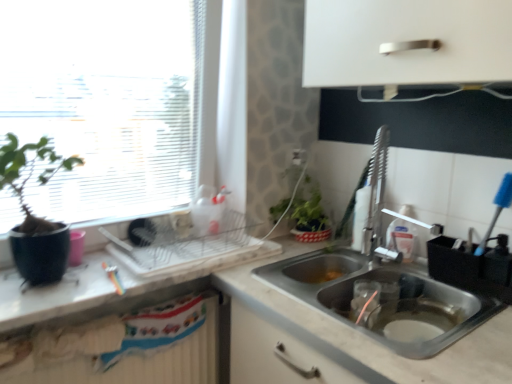
Image resolution: width=512 pixels, height=384 pixels. What do you see at coordinates (375, 341) in the screenshot?
I see `white marble countertop at lower right, which appears as the second countertop when viewed from the top` at bounding box center [375, 341].

Based on the photo, in order to face black plastic utensil holder at sink, the first appliance viewed from the right, should I rotate leftwards or rightwards?

Answer: It's best to rotate right around 27.925 degrees.

Measure the distance between point (96, 146) and camera.

The depth of point (96, 146) is 4.24 feet.

The height and width of the screenshot is (384, 512). Identify the location of white textured radiator at lower left. (113, 350).

Locate an element on the screen. The height and width of the screenshot is (384, 512). stainless steel sink at lower right, which is the first sink in top-to-bottom order is located at coordinates (340, 254).

What is the approximate height of stainless steel sink at lower right, acting as the 2th sink starting from the bottom?

It is 17.94 inches.

Describe the element at coordinates (101, 286) in the screenshot. I see `white marble countertop at left, acting as the first countertop starting from the top` at that location.

You are a GUI agent. You are given a task and a screenshot of the screen. Output one action in this format:
    pyautogui.click(x=<x>, y=<y>)
    Task: Click on the matte black pot at left
    
    Given the screenshot: What is the action you would take?
    pyautogui.click(x=31, y=212)

You are a GUI agent. You are given a task and a screenshot of the screen. Output one action in this format:
    pyautogui.click(x=<x>, y=<y>)
    Task: Click on the white marble countertop at lower right, positioned as the 1th countertop in bottom-to-top order
    
    Given the screenshot: What is the action you would take?
    pyautogui.click(x=375, y=341)

Is the surface of white marble countertop at left, the 2th countertop positioned from the bottom, in direct contact with metallic dish rack at center, the second appliance positioned from the right?

white marble countertop at left, the 2th countertop positioned from the bottom, is not next to metallic dish rack at center, the second appliance positioned from the right, and they're not touching.

From a real-world perspective, is white marble countertop at left, acting as the first countertop starting from the top, below metallic dish rack at center, the second appliance positioned from the right?

Yes.

How distant is white marble countertop at left, the 2th countertop positioned from the bottom, from metallic dish rack at center, acting as the first appliance starting from the left?

white marble countertop at left, the 2th countertop positioned from the bottom, is 4.15 inches from metallic dish rack at center, acting as the first appliance starting from the left.

From the image's perspective, would you say white marble countertop at left, the 2th countertop positioned from the bottom, is positioned over metallic dish rack at center, the second appliance positioned from the right?

Incorrect, from the image's perspective, white marble countertop at left, the 2th countertop positioned from the bottom, is lower than metallic dish rack at center, the second appliance positioned from the right.

Measure the distance from matte black pot at left to stainless steel sink at lower right, the first sink ordered from the bottom.

A distance of 31.22 inches exists between matte black pot at left and stainless steel sink at lower right, the first sink ordered from the bottom.

From the image's perspective, is matte black pot at left located beneath stainless steel sink at lower right, the first sink ordered from the bottom?

No.

What's the angular difference between matte black pot at left and stainless steel sink at lower right, the first sink ordered from the bottom,'s facing directions?

They differ by 90 degrees in their facing directions.

Is matte black pot at left wider or thinner than stainless steel sink at lower right, acting as the second sink starting from the top?

Considering their sizes, matte black pot at left looks slimmer than stainless steel sink at lower right, acting as the second sink starting from the top.

Can you tell me how much transparent glass window at upper left and white textured radiator at lower left differ in facing direction?

transparent glass window at upper left and white textured radiator at lower left are facing 2.85 degrees away from each other.

The width and height of the screenshot is (512, 384). Identify the location of window in front of the white textured radiator at lower left. (111, 100).

Is transparent glass window at upper left in front of or behind white textured radiator at lower left in the image?

Visually, transparent glass window at upper left is located in front of white textured radiator at lower left.

Which of these two, metallic dish rack at center, acting as the first appliance starting from the left, or white marble countertop at left, the 2th countertop positioned from the bottom, is smaller?

Smaller between the two is metallic dish rack at center, acting as the first appliance starting from the left.

Locate an element on the screen. The image size is (512, 384). countertop on the left of metallic dish rack at center, the second appliance positioned from the right is located at coordinates (101, 286).

Between metallic dish rack at center, the second appliance positioned from the right, and white marble countertop at left, the 2th countertop positioned from the bottom, which one has less height?

metallic dish rack at center, the second appliance positioned from the right.

Is metallic dish rack at center, acting as the first appliance starting from the left, oriented away from white marble countertop at left, acting as the first countertop starting from the top?

metallic dish rack at center, acting as the first appliance starting from the left, is not turned away from white marble countertop at left, acting as the first countertop starting from the top.

From the picture: How much distance is there between black plastic utensil holder at sink, the first appliance viewed from the right, and transparent glass window at upper left?

3.41 feet.

Considering the sizes of black plastic utensil holder at sink, acting as the 2th appliance starting from the left, and transparent glass window at upper left in the image, is black plastic utensil holder at sink, acting as the 2th appliance starting from the left, taller or shorter than transparent glass window at upper left?

Clearly, black plastic utensil holder at sink, acting as the 2th appliance starting from the left, is shorter compared to transparent glass window at upper left.

Can you confirm if black plastic utensil holder at sink, acting as the 2th appliance starting from the left, is smaller than transparent glass window at upper left?

Yes, black plastic utensil holder at sink, acting as the 2th appliance starting from the left, is smaller than transparent glass window at upper left.

Would you say white marble countertop at lower right, positioned as the 1th countertop in bottom-to-top order, is to the left or to the right of stainless steel sink at lower right, the first sink ordered from the bottom, in the picture?

From the image, it's evident that white marble countertop at lower right, positioned as the 1th countertop in bottom-to-top order, is to the left of stainless steel sink at lower right, the first sink ordered from the bottom.

From a real-world perspective, is white marble countertop at lower right, which appears as the second countertop when viewed from the top, physically located above or below stainless steel sink at lower right, the first sink ordered from the bottom?

Clearly, from a real-world perspective, white marble countertop at lower right, which appears as the second countertop when viewed from the top, is below stainless steel sink at lower right, the first sink ordered from the bottom.

Which of these two, white marble countertop at lower right, which appears as the second countertop when viewed from the top, or stainless steel sink at lower right, the first sink ordered from the bottom, is wider?

Wider between the two is white marble countertop at lower right, which appears as the second countertop when viewed from the top.

Where is `sink above the metallic dish rack at center, the second appliance positioned from the right (from a real-world perspective)`? The image size is (512, 384). sink above the metallic dish rack at center, the second appliance positioned from the right (from a real-world perspective) is located at coordinates (340, 254).

Looking at this image, can you confirm if stainless steel sink at lower right, acting as the 2th sink starting from the bottom, is bigger than metallic dish rack at center, acting as the first appliance starting from the left?

Yes, stainless steel sink at lower right, acting as the 2th sink starting from the bottom, is bigger than metallic dish rack at center, acting as the first appliance starting from the left.

Is stainless steel sink at lower right, which is the first sink in top-to-bottom order, far away from metallic dish rack at center, acting as the first appliance starting from the left?

stainless steel sink at lower right, which is the first sink in top-to-bottom order, is near metallic dish rack at center, acting as the first appliance starting from the left, not far away.

From the image's perspective, is stainless steel sink at lower right, acting as the 2th sink starting from the bottom, on metallic dish rack at center, acting as the first appliance starting from the left?

Yes.

From a real-world perspective, starting from the white marble countertop at left, the 2th countertop positioned from the bottom, which appliance is the 1st one vertically above it? Please provide its 2D coordinates.

[(181, 245)]

Where is `sink below the matte black pot at left (from the image's perspective)`? sink below the matte black pot at left (from the image's perspective) is located at coordinates (382, 299).

From the image, which object appears to be farther from matte black pot at left, white textured radiator at lower left or stainless steel sink at lower right, the first sink ordered from the bottom?

Based on the image, stainless steel sink at lower right, the first sink ordered from the bottom, appears to be further to matte black pot at left.

From the image, which object appears to be nearer to stainless steel sink at lower right, which is the first sink in top-to-bottom order, matte black pot at left or white marble countertop at lower right, positioned as the 1th countertop in bottom-to-top order?

white marble countertop at lower right, positioned as the 1th countertop in bottom-to-top order.

Which object lies further to the anchor point transparent glass window at upper left, matte black pot at left or black plastic utensil holder at sink, the first appliance viewed from the right?

Among the two, black plastic utensil holder at sink, the first appliance viewed from the right, is located further to transparent glass window at upper left.

Considering their positions, is metallic dish rack at center, the second appliance positioned from the right, positioned further to transparent glass window at upper left than white marble countertop at lower right, positioned as the 1th countertop in bottom-to-top order?

white marble countertop at lower right, positioned as the 1th countertop in bottom-to-top order.

When comparing their distances from white marble countertop at left, the 2th countertop positioned from the bottom, does black plastic utensil holder at sink, the first appliance viewed from the right, or stainless steel sink at lower right, acting as the 2th sink starting from the bottom, seem further?

The object further to white marble countertop at left, the 2th countertop positioned from the bottom, is black plastic utensil holder at sink, the first appliance viewed from the right.

Considering their positions, is stainless steel sink at lower right, acting as the 2th sink starting from the bottom, positioned closer to matte black pot at left than white marble countertop at left, the 2th countertop positioned from the bottom?

Among the two, white marble countertop at left, the 2th countertop positioned from the bottom, is located nearer to matte black pot at left.

Looking at the image, which one is located closer to stainless steel sink at lower right, acting as the second sink starting from the top, white marble countertop at left, acting as the first countertop starting from the top, or black plastic utensil holder at sink, acting as the 2th appliance starting from the left?

black plastic utensil holder at sink, acting as the 2th appliance starting from the left, lies closer to stainless steel sink at lower right, acting as the second sink starting from the top, than the other object.

When comparing their distances from white marble countertop at lower right, positioned as the 1th countertop in bottom-to-top order, does white marble countertop at left, the 2th countertop positioned from the bottom, or black plastic utensil holder at sink, the first appliance viewed from the right, seem further?

The object further to white marble countertop at lower right, positioned as the 1th countertop in bottom-to-top order, is white marble countertop at left, the 2th countertop positioned from the bottom.

Identify the location of radiator between transparent glass window at upper left and stainless steel sink at lower right, which is the first sink in top-to-bottom order, in the horizontal direction. This screenshot has width=512, height=384. (113, 350).

Find the location of `appliance between white textured radiator at lower left and black plastic utensil holder at sink, acting as the 2th appliance starting from the left, in the horizontal direction`. appliance between white textured radiator at lower left and black plastic utensil holder at sink, acting as the 2th appliance starting from the left, in the horizontal direction is located at coordinates (181, 245).

The image size is (512, 384). In order to click on appliance between transparent glass window at upper left and stainless steel sink at lower right, which is the first sink in top-to-bottom order in this screenshot , I will do `click(181, 245)`.

This screenshot has width=512, height=384. In order to click on appliance between transparent glass window at upper left and stainless steel sink at lower right, the first sink ordered from the bottom in this screenshot , I will do `click(181, 245)`.